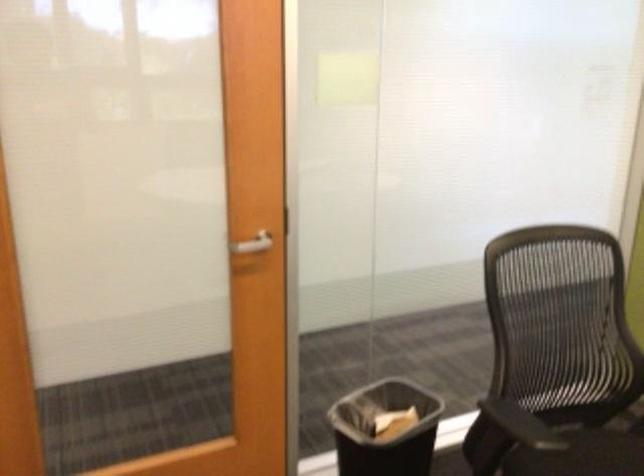
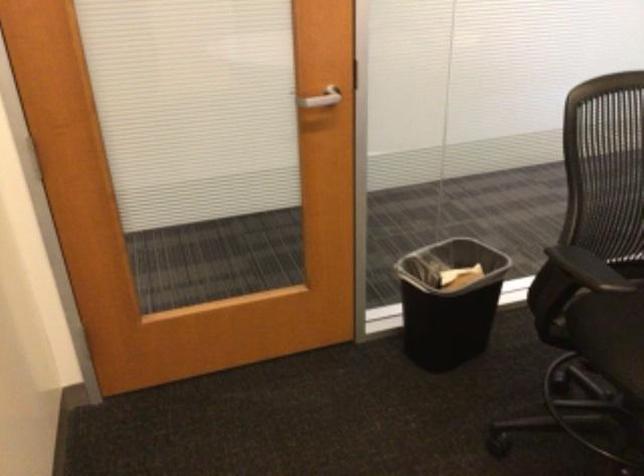
Locate, in the second image, the point that corresponds to point (252, 246) in the first image.

(321, 98)